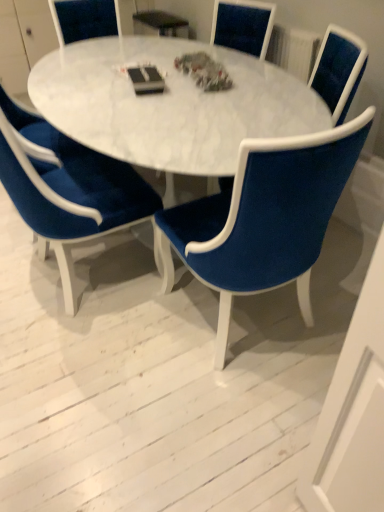
I want to click on free location in front of velvet blue chair at center, the first chair in the left-to-right sequence, so click(84, 359).